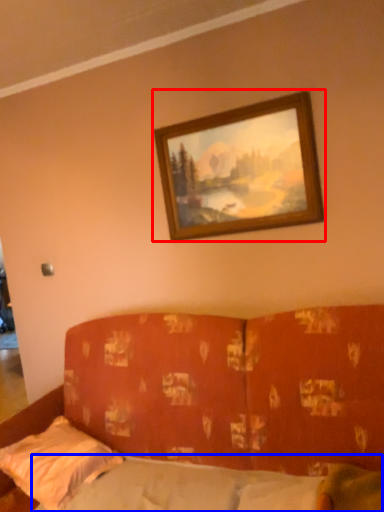
Question: Which object is closer to the camera taking this photo, picture frame (highlighted by a red box) or mattress (highlighted by a blue box)?

Choices:
 (A) picture frame
 (B) mattress

Answer: (B)